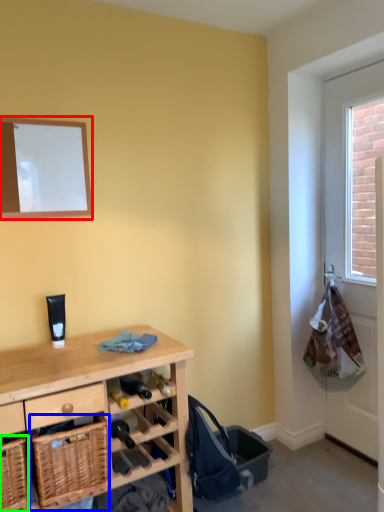
Question: Which is farther away from mirror (highlighted by a red box)? basket (highlighted by a blue box) or basket (highlighted by a green box)?

Choices:
 (A) basket
 (B) basket

Answer: (B)